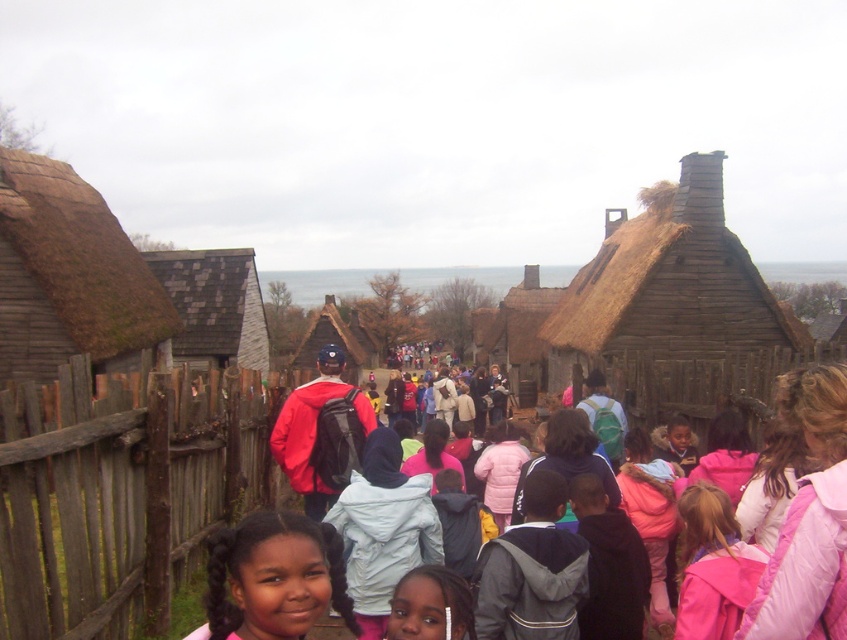
You are a visitor at the historical site and want to take a photo of the brown thatched roof hut at center without any people blocking it. The pink fleece jacket at center is currently in front of the hut. Can you stand closer to the hut to get a clear shot?

The pink fleece jacket at center is shorter than the brown thatched roof hut at center, so if you move closer to the hut, you can position yourself so that the jacket is no longer blocking the view. Since the jacket is shorter, you might be able to see over it or move around it to capture the hut without obstruction.

You are a teacher leading a field trip to this historical site. You notice the brown wooden fence at lower left and the thatched wood hut at left. Which structure would you estimate to be closer to the group of children in the foreground?

The brown wooden fence at lower left is closer to the group of children in the foreground because it has a smaller size compared to the thatched wood hut at left, indicating it is nearer to the observer.

You are a photographer standing at the entrance of the historical site. You want to take a photo that includes both the pink fleece jacket at center and the brown thatched roof hut at center. Which object should you focus on first to ensure both are in the frame?

You should focus on the pink fleece jacket at center first because it is closer to the viewer than the brown thatched roof hut at center, so adjusting the focus starting from the closer object ensures both are in the frame.